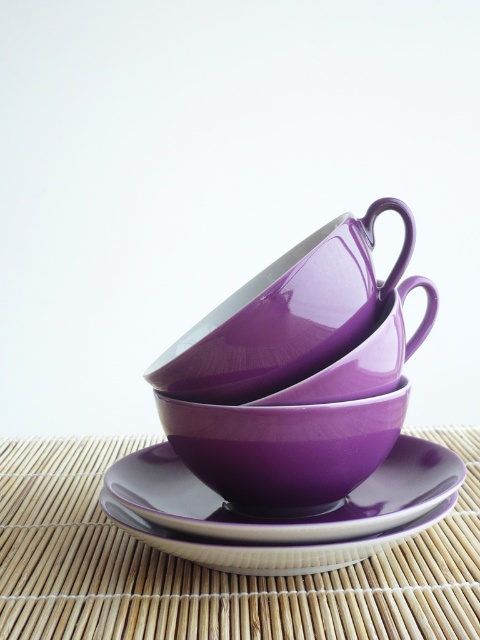
Question: Estimate the real-world distances between objects in this image. Which object is farther from the white glossy plate at center?

Choices:
 (A) purple glossy saucer at center
 (B) glossy purple teacup at center
 (C) purple glossy cup at center

Answer: (B)

Question: Does glossy ceramic bowl at center come in front of glossy purple teacup at center?

Choices:
 (A) no
 (B) yes

Answer: (B)

Question: Which point is closer to the camera?

Choices:
 (A) glossy ceramic bowl at center
 (B) purple glossy saucer at center
 (C) glossy ceramic teacup at center

Answer: (B)

Question: Does glossy ceramic teacup at center appear on the right side of glossy purple teacup at center?

Choices:
 (A) yes
 (B) no

Answer: (B)

Question: Which of the following is the farthest from the observer?

Choices:
 (A) (90, 490)
 (B) (107, 477)
 (C) (148, 541)

Answer: (A)

Question: Does white glossy plate at center have a smaller size compared to glossy purple teacup at center?

Choices:
 (A) no
 (B) yes

Answer: (B)